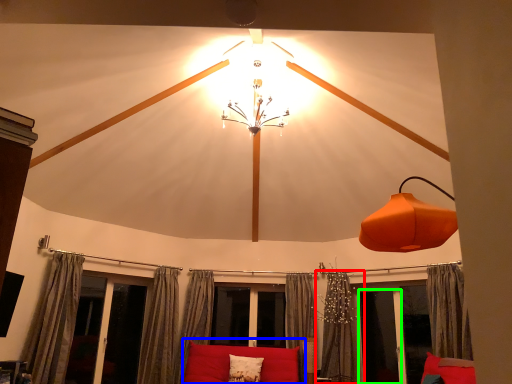
Question: Considering the real-world distances, which object is farthest from curtain (highlighted by a red box)? couch (highlighted by a blue box) or screen door (highlighted by a green box)?

Choices:
 (A) couch
 (B) screen door

Answer: (A)